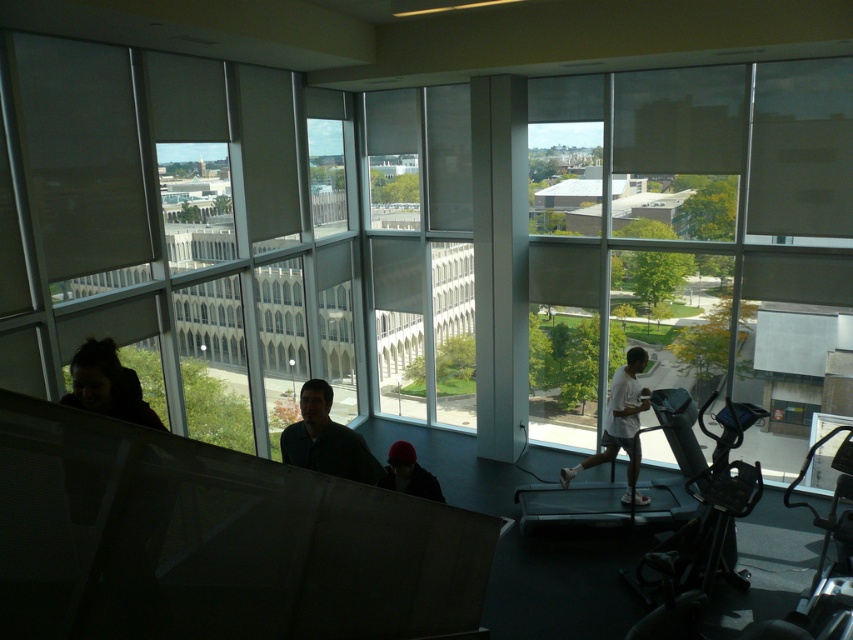
From the picture: You are standing in the gymnasium and see the point marked at coordinates (326, 440). What object is located at that point?

The point at coordinates (326, 440) marks the location of the dark blue shirt at center.

You are standing in the gymnasium looking through the large windows. You notice a point at coordinates (x=619, y=424) on the image. What object does this point correspond to?

The point at coordinates (x=619, y=424) corresponds to the white matte shirt at center.